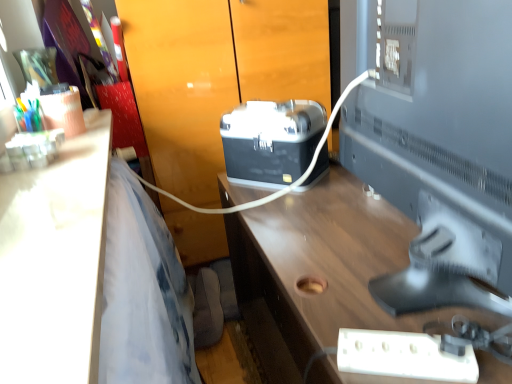
Question: From the image's perspective, does white plastic extension cord at lower right appear lower than black plastic projector at center?

Choices:
 (A) yes
 (B) no

Answer: (A)

Question: Considering the relative sizes of white plastic extension cord at lower right and black plastic projector at center in the image provided, is white plastic extension cord at lower right taller than black plastic projector at center?

Choices:
 (A) yes
 (B) no

Answer: (B)

Question: Is white plastic extension cord at lower right with black plastic projector at center?

Choices:
 (A) no
 (B) yes

Answer: (A)

Question: Is white plastic extension cord at lower right shorter than black plastic projector at center?

Choices:
 (A) yes
 (B) no

Answer: (A)

Question: Can you confirm if white plastic extension cord at lower right is wider than black plastic projector at center?

Choices:
 (A) no
 (B) yes

Answer: (A)

Question: Considering the positions of white glossy desk at left, which is the first desk from left to right, and black plastic projector at center in the image, is white glossy desk at left, which is the first desk from left to right, bigger or smaller than black plastic projector at center?

Choices:
 (A) big
 (B) small

Answer: (B)

Question: Does point (40, 251) appear closer or farther from the camera than point (261, 173)?

Choices:
 (A) closer
 (B) farther

Answer: (A)

Question: Is white glossy desk at left, which is the first desk from left to right, in front of or behind black plastic projector at center in the image?

Choices:
 (A) front
 (B) behind

Answer: (A)

Question: From the image's perspective, is white glossy desk at left, the second desk viewed from the right, above or below black plastic projector at center?

Choices:
 (A) above
 (B) below

Answer: (B)

Question: Looking at the image, does black plastic projector at center seem bigger or smaller compared to satin silver monitor at right?

Choices:
 (A) small
 (B) big

Answer: (A)

Question: Is black plastic projector at center spatially inside satin silver monitor at right, or outside of it?

Choices:
 (A) outside
 (B) inside

Answer: (A)

Question: From the image's perspective, is black plastic projector at center above or below satin silver monitor at right?

Choices:
 (A) above
 (B) below

Answer: (A)

Question: Relative to satin silver monitor at right, is black plastic projector at center in front or behind?

Choices:
 (A) behind
 (B) front

Answer: (B)

Question: Considering the relative positions of matte black toolbox at center and black plastic projector at center in the image provided, is matte black toolbox at center to the left or to the right of black plastic projector at center?

Choices:
 (A) right
 (B) left

Answer: (B)

Question: In terms of size, does matte black toolbox at center appear bigger or smaller than black plastic projector at center?

Choices:
 (A) small
 (B) big

Answer: (B)